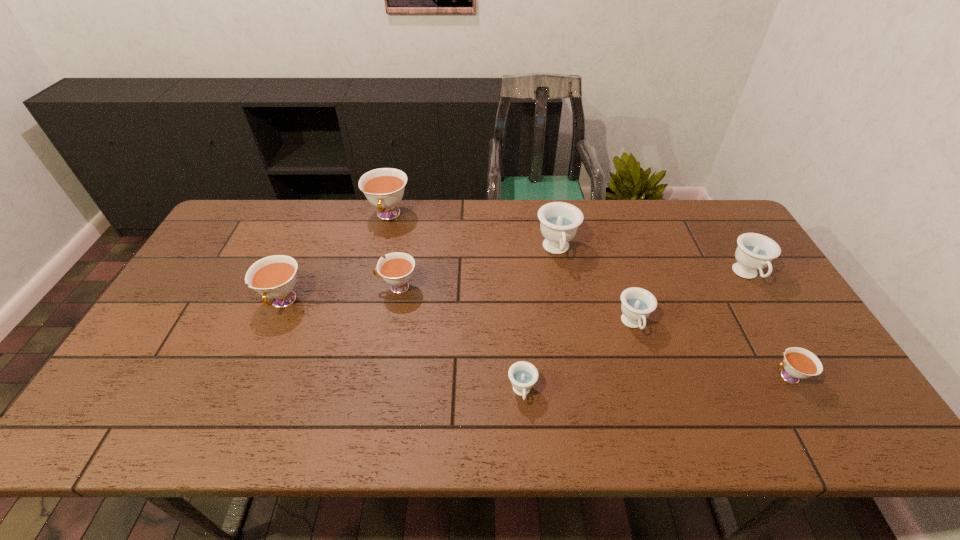
The image size is (960, 540). Find the location of `vacant space located on the side of the third biggest white teacup with the handle`. vacant space located on the side of the third biggest white teacup with the handle is located at coordinates (311, 287).

The width and height of the screenshot is (960, 540). Identify the location of free space located on the side of the third teacup from right to left with the handle. (666, 430).

You are a GUI agent. You are given a task and a screenshot of the screen. Output one action in this format:
    pyautogui.click(x=<x>, y=<y>)
    Task: Click on the free space located 0.290m on the side of the smallest white teacup with the handle
    The height and width of the screenshot is (540, 960).
    Given the screenshot: What is the action you would take?
    pyautogui.click(x=649, y=377)

You are a GUI agent. You are given a task and a screenshot of the screen. Output one action in this format:
    pyautogui.click(x=<x>, y=<y>)
    Task: Click on the vacant space located 0.120m on the side of the smallest white teacup with the handle
    Image resolution: width=960 pixels, height=540 pixels.
    Given the screenshot: What is the action you would take?
    pyautogui.click(x=719, y=377)

Locate an element on the screen. The image size is (960, 540). vacant area situated 0.090m on the side of the smallest white teacup with the handle is located at coordinates (732, 377).

Locate an element on the screen. Image resolution: width=960 pixels, height=540 pixels. free location located 0.050m on the side of the smallest blue teacup with the handle is located at coordinates (525, 430).

The image size is (960, 540). What are the coordinates of `object positioned at the near edge` in the screenshot? It's located at (523, 375).

The width and height of the screenshot is (960, 540). In order to click on blank space at the far edge of the desktop in this screenshot , I will do `click(660, 224)`.

The width and height of the screenshot is (960, 540). Identify the location of free space at the near edge of the desktop. (359, 433).

Where is `vacant region at the right edge of the desktop`? Image resolution: width=960 pixels, height=540 pixels. vacant region at the right edge of the desktop is located at coordinates (719, 259).